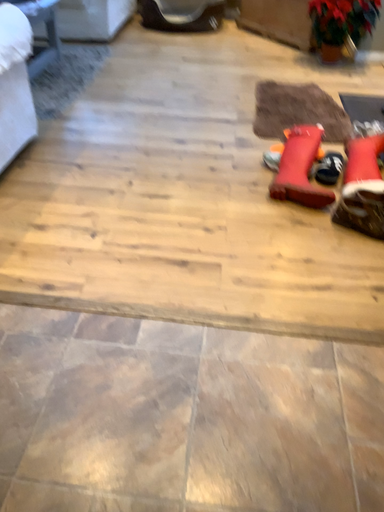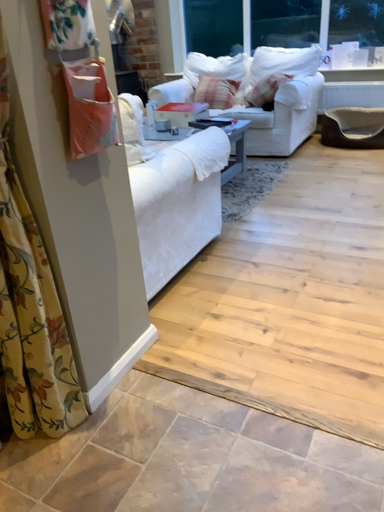
Question: Which way did the camera rotate in the video?

Choices:
 (A) rotated upward
 (B) rotated downward

Answer: (A)